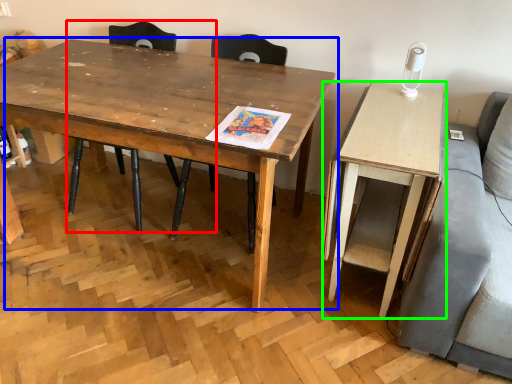
Question: Which object is positioned closest to chair (highlighted by a red box)? Select from coffee table (highlighted by a blue box) and desk (highlighted by a green box).

Choices:
 (A) coffee table
 (B) desk

Answer: (A)